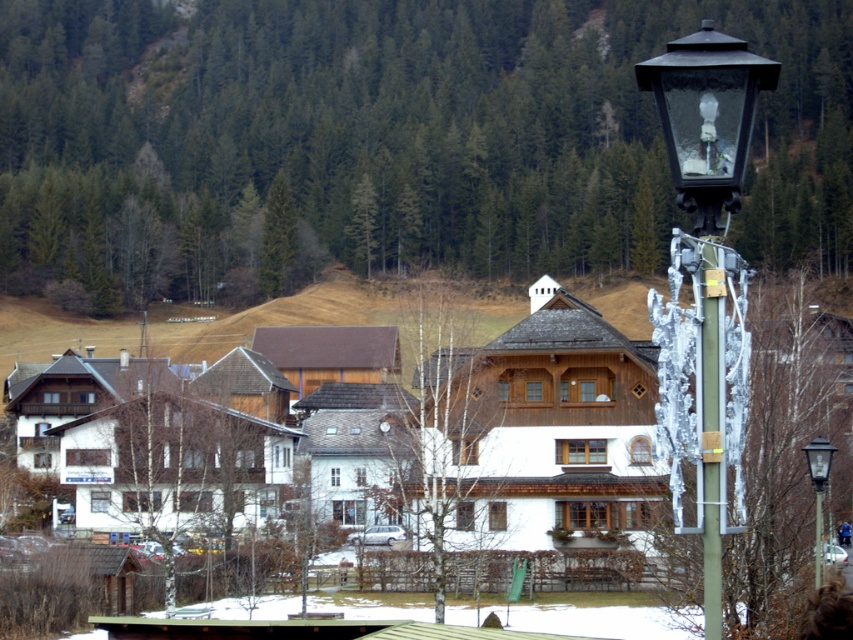
Which of these two, black glass street light at right or black glass street light at upper right, stands taller?

black glass street light at right

Is point (699, 312) positioned behind point (817, 513)?

No, it is in front of (817, 513).

Is point (718, 93) farther from viewer compared to point (815, 508)?

No, it is in front of (815, 508).

Where is `black glass street light at right`? The image size is (853, 640). black glass street light at right is located at coordinates (705, 285).

Does green matte tree at upper center have a lesser height compared to black glass street light at upper right?

No, green matte tree at upper center is not shorter than black glass street light at upper right.

Which is behind, point (537, 141) or point (817, 449)?

The point (537, 141) is behind.

The image size is (853, 640). In order to click on green matte tree at upper center in this screenshot , I will do `click(387, 141)`.

Is green matte tree at upper center positioned before green metallic pole at center-right?

Yes, green matte tree at upper center is closer to the viewer.

Looking at this image, does green matte tree at upper center have a greater width compared to green metallic pole at center-right?

Yes, green matte tree at upper center is wider than green metallic pole at center-right.

Does point (288, 211) lie behind point (712, 456)?

That is True.

At what (x,y) coordinates should I click in order to perform the action: click on green matte tree at upper center. Please return your answer as a coordinate pair (x, y). The image size is (853, 640). Looking at the image, I should click on (387, 141).